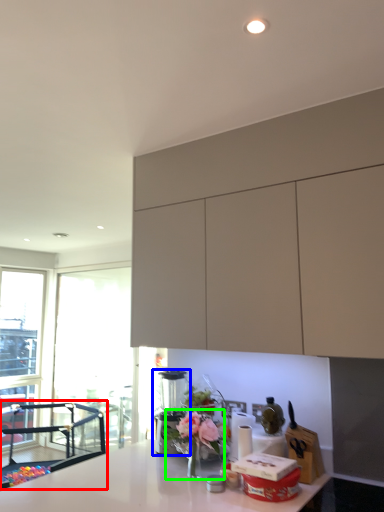
Question: Which object is positioned closest to chair (highlighted by a red box)? Select from coffee machine (highlighted by a blue box) and floral arrangement (highlighted by a green box).

Choices:
 (A) coffee machine
 (B) floral arrangement

Answer: (A)